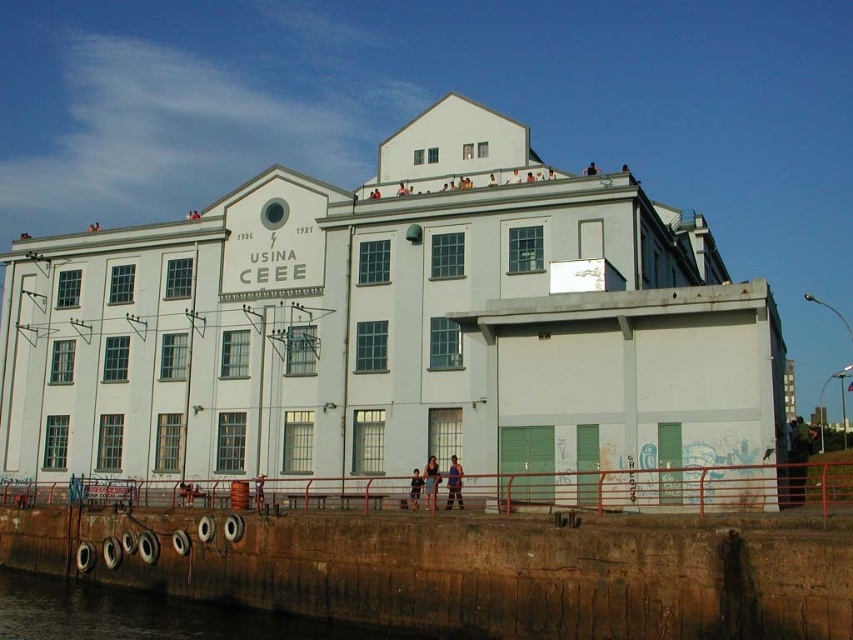
You are standing in front of the USINA CEEE building. There is a point marked at coordinates (149,616). What is located at this point?

The point at coordinates (149,616) marks brown concrete water at lower left.

You are standing at the entrance of the USINA CEEE building and want to locate the brown concrete water at lower left. According to the coordinates provided, where exactly should you look to find it?

The brown concrete water at lower left is located at the 2D coordinates point (149, 616).